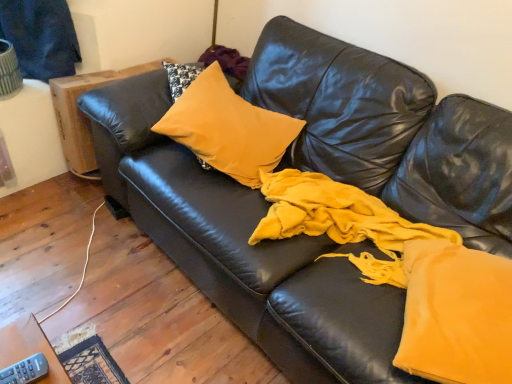
Question: Can you confirm if mustard velvet pillow at center is thinner than gray plastic remote at lower left?

Choices:
 (A) yes
 (B) no

Answer: (B)

Question: Would you say mustard velvet pillow at center is outside gray plastic remote at lower left?

Choices:
 (A) yes
 (B) no

Answer: (A)

Question: Can you confirm if mustard velvet pillow at center is wider than gray plastic remote at lower left?

Choices:
 (A) yes
 (B) no

Answer: (A)

Question: Considering the relative sizes of mustard velvet pillow at center and gray plastic remote at lower left in the image provided, is mustard velvet pillow at center bigger than gray plastic remote at lower left?

Choices:
 (A) yes
 (B) no

Answer: (A)

Question: Is mustard velvet pillow at center far from gray plastic remote at lower left?

Choices:
 (A) no
 (B) yes

Answer: (B)

Question: Considering the positions of gray plastic remote at lower left and mustard velvet pillow at center in the image, is gray plastic remote at lower left bigger or smaller than mustard velvet pillow at center?

Choices:
 (A) small
 (B) big

Answer: (A)

Question: From the image's perspective, is gray plastic remote at lower left located above or below mustard velvet pillow at center?

Choices:
 (A) below
 (B) above

Answer: (A)

Question: Based on their positions, is gray plastic remote at lower left located to the left or right of mustard velvet pillow at center?

Choices:
 (A) right
 (B) left

Answer: (B)

Question: Considering the positions of point (39, 372) and point (247, 182), is point (39, 372) closer or farther from the camera than point (247, 182)?

Choices:
 (A) closer
 (B) farther

Answer: (A)

Question: From the image's perspective, relative to gray plastic remote at lower left, is wooden side table at left above or below?

Choices:
 (A) below
 (B) above

Answer: (B)

Question: Is wooden side table at left bigger or smaller than gray plastic remote at lower left?

Choices:
 (A) big
 (B) small

Answer: (A)

Question: Relative to gray plastic remote at lower left, is wooden side table at left in front or behind?

Choices:
 (A) behind
 (B) front

Answer: (A)

Question: Do you think wooden side table at left is within gray plastic remote at lower left, or outside of it?

Choices:
 (A) outside
 (B) inside

Answer: (A)

Question: Is wooden side table at left wider or thinner than mustard velvet pillow at center?

Choices:
 (A) wide
 (B) thin

Answer: (A)

Question: Considering the positions of wooden side table at left and mustard velvet pillow at center in the image, is wooden side table at left taller or shorter than mustard velvet pillow at center?

Choices:
 (A) short
 (B) tall

Answer: (B)